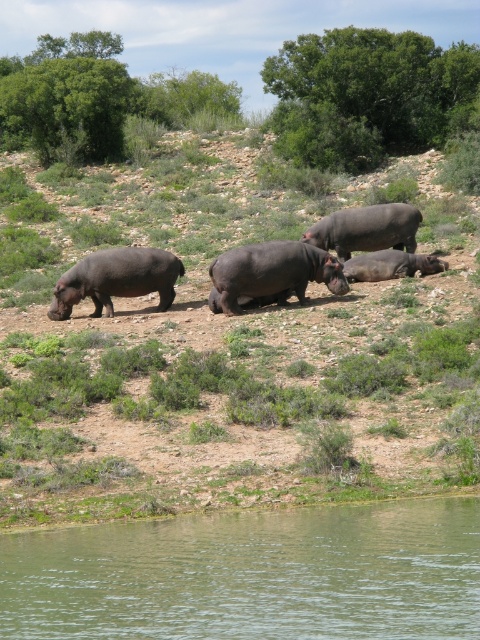
You are a hiker who wants to cross the river to reach the other side. You see the greenish water at lower left and the matte gray hippo at center. Which direction should you head to avoid the water?

The greenish water at lower left is below the matte gray hippo at center, so you should head upwards away from the greenish water at lower left to avoid the water.

You are a small animal trying to reach the water to drink. You see the greenish water at lower left and the dark gray matte hippo at left. Which direction should you go to reach the water without getting too close to the hippo?

The greenish water at lower left is located below the dark gray matte hippo at left, so you should move downward towards the greenish water at lower left while staying away from the hippo.

You are a wildlife photographer aiming to capture a photo of the matte gray hippo at center and the dark gray matte hippo at left. You want to ensure both hippos are in focus. Given that your camera can only focus on objects within a 1.2 meter height range, will both hippos fit within this range?

The matte gray hippo at center is shorter than the dark gray matte hippo at left. Since the height difference between them is within the 1.2 meter focus range of the camera, both hippos can be in focus.